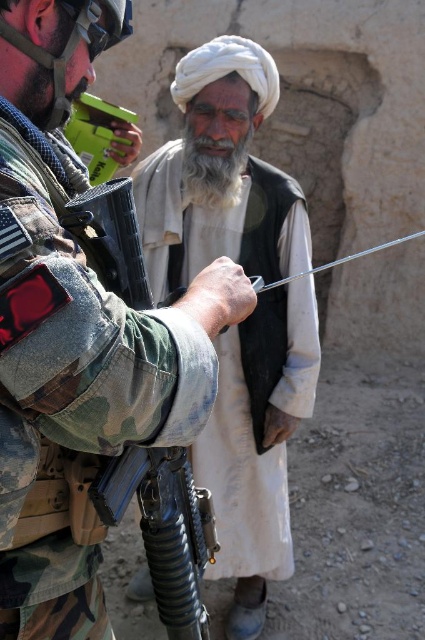
You are a photographer trying to capture a clear shot of both the white cotton turban at upper center and the white soft beard at center. Since you want both subjects to be in focus, which object should you adjust your camera focus on first?

The white cotton turban at upper center is closer to the viewer than the white soft beard at center, so you should focus on the white cotton turban at upper center first to ensure both are in focus.

Based on the scene description and the coordinates provided, what object is located at the point with coordinates (78, 321)?

The point at coordinates (78, 321) indicates the camouflage fabric uniform at left.